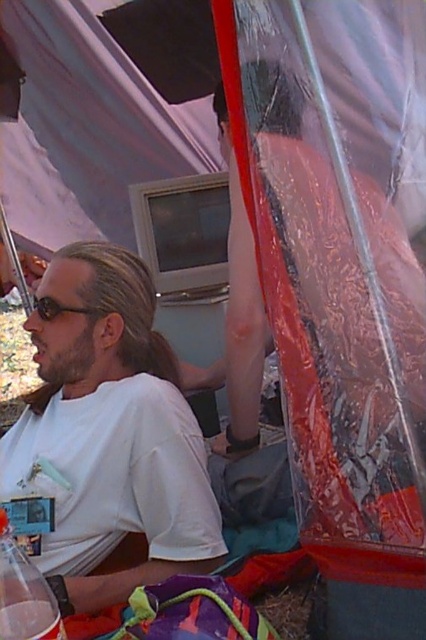
Looking at this image, does white matte shirt at center appear under clear plastic cup at lower left?

Incorrect, white matte shirt at center is not positioned below clear plastic cup at lower left.

Who is more distant from viewer, [112,490] or [13,630]?

Positioned behind is point [112,490].

At what (x,y) coordinates should I click in order to perform the action: click on white matte shirt at center. Please return your answer as a coordinate pair (x, y). This screenshot has height=640, width=426. Looking at the image, I should click on (109, 433).